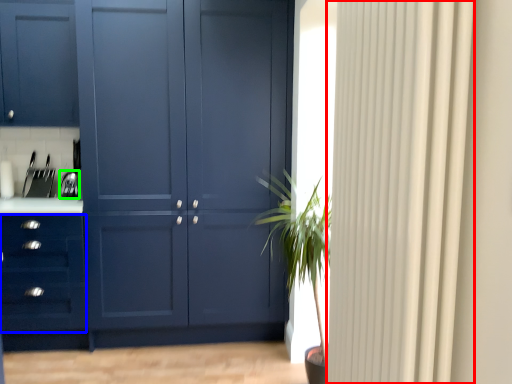
Question: Estimate the real-world distances between objects in this image. Which object is closer to curtain (highlighted by a red box), drawer (highlighted by a blue box) or appliance (highlighted by a green box)?

Choices:
 (A) drawer
 (B) appliance

Answer: (A)